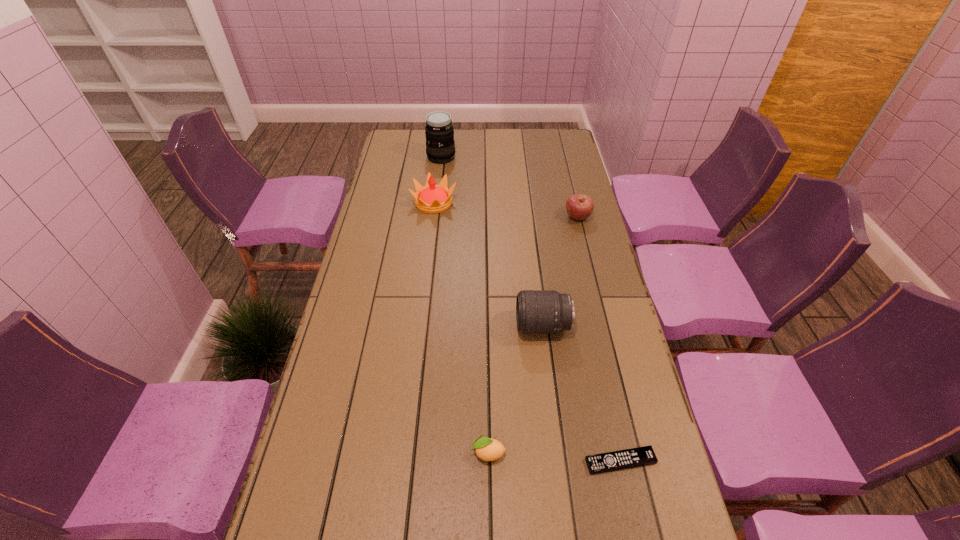
At what (x,y) coordinates should I click in order to perform the action: click on vacant space located 0.160m on the left of the shortest object. Please return your answer as a coordinate pair (x, y). This screenshot has height=540, width=960. Looking at the image, I should click on (517, 461).

Where is `object that is at the far edge`? This screenshot has height=540, width=960. object that is at the far edge is located at coordinates (440, 147).

Identify the location of object positioned at the left edge. This screenshot has height=540, width=960. (432, 198).

Where is `telephoto lens that is positioned at the right edge`? The image size is (960, 540). telephoto lens that is positioned at the right edge is located at coordinates (537, 312).

Image resolution: width=960 pixels, height=540 pixels. What are the coordinates of `apple located in the right edge section of the desktop` in the screenshot? It's located at (579, 207).

Identify the location of remote control located at the right edge. (x=640, y=456).

The width and height of the screenshot is (960, 540). In the image, there is a desktop. Find the location of `free space at the far edge`. free space at the far edge is located at coordinates (528, 144).

Find the location of a particular element. Image resolution: width=960 pixels, height=540 pixels. vacant space at the left edge is located at coordinates (360, 431).

Locate an element on the screen. The image size is (960, 540). free location at the right edge is located at coordinates (655, 494).

I want to click on vacant space at the far right corner of the desktop, so click(x=556, y=151).